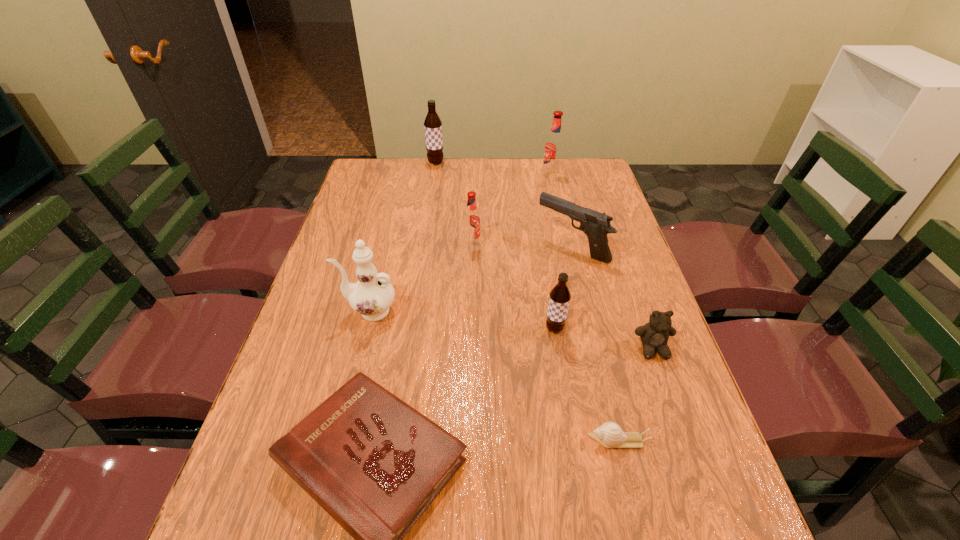
This screenshot has height=540, width=960. I want to click on free space located 0.220m at the muzzle of the sixth tallest object, so click(465, 247).

You are a GUI agent. You are given a task and a screenshot of the screen. Output one action in this format:
    pyautogui.click(x=<x>, y=<y>)
    Task: Click on the free space located 0.070m at the muzzle of the sixth tallest object
    
    Given the screenshot: What is the action you would take?
    pyautogui.click(x=515, y=247)

Where is `free spot located 0.140m on the face of the third shortest object`? free spot located 0.140m on the face of the third shortest object is located at coordinates (677, 417).

In order to click on free space located on the shell of the escargot in this screenshot , I will do `click(494, 441)`.

Locate an element on the screen. Image resolution: width=960 pixels, height=540 pixels. free space located on the shell of the escargot is located at coordinates (420, 441).

Locate an element on the screen. vacant position located 0.350m on the shell of the escargot is located at coordinates (415, 441).

Where is `object that is at the left edge`? This screenshot has height=540, width=960. object that is at the left edge is located at coordinates (373, 294).

Where is `root beer present at the right edge`? This screenshot has height=540, width=960. root beer present at the right edge is located at coordinates (554, 145).

Locate an element on the screen. gun positioned at the right edge is located at coordinates (596, 225).

This screenshot has width=960, height=540. In order to click on teddy bear at the right edge in this screenshot , I will do `click(654, 335)`.